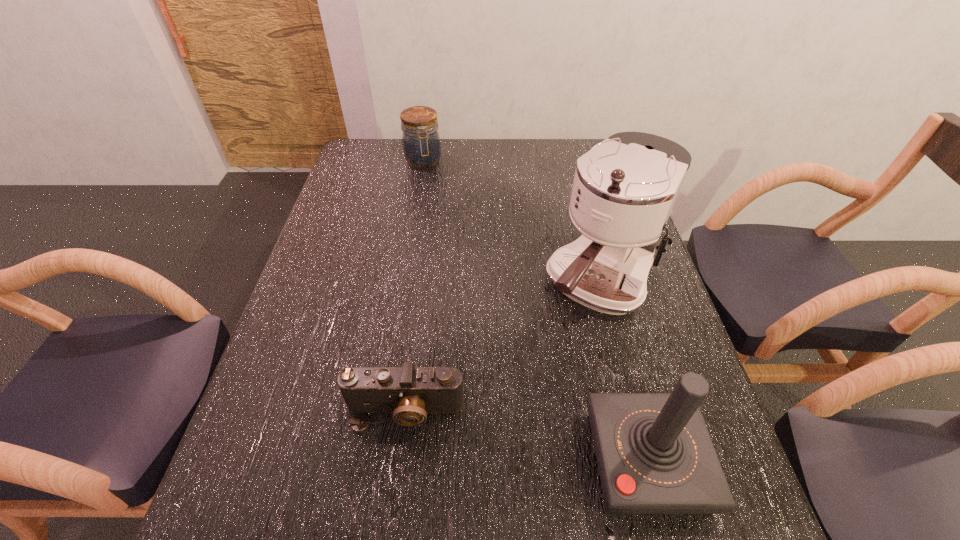
Where is `the shortest object`? Image resolution: width=960 pixels, height=540 pixels. the shortest object is located at coordinates (409, 393).

Find the location of a particular element. The height and width of the screenshot is (540, 960). joystick is located at coordinates (654, 453).

Where is `the farthest object`? This screenshot has width=960, height=540. the farthest object is located at coordinates (421, 143).

Where is `the third tallest object`? This screenshot has height=540, width=960. the third tallest object is located at coordinates (421, 143).

Find the location of a particular element. This screenshot has width=960, height=540. the tallest object is located at coordinates (624, 189).

I want to click on the second farthest object, so click(624, 189).

Locate an element on the screen. This screenshot has width=960, height=540. blank space located 0.050m on the front-facing side of the shortest object is located at coordinates [x=398, y=460].

Locate an element on the screen. The height and width of the screenshot is (540, 960). vacant region located on the lid of the third tallest object is located at coordinates (427, 181).

Locate an element on the screen. Image resolution: width=960 pixels, height=540 pixels. free space located on the lid of the third tallest object is located at coordinates (430, 190).

Find the location of a particular element. The image size is (960, 540). free spot located on the lid of the third tallest object is located at coordinates (438, 224).